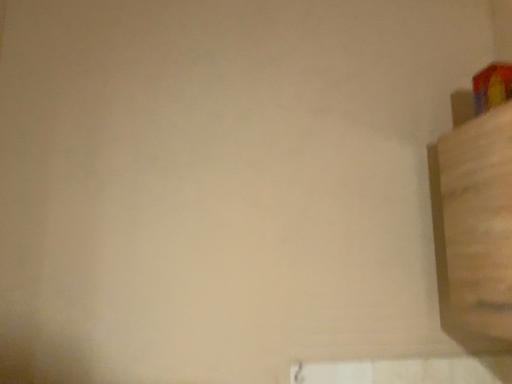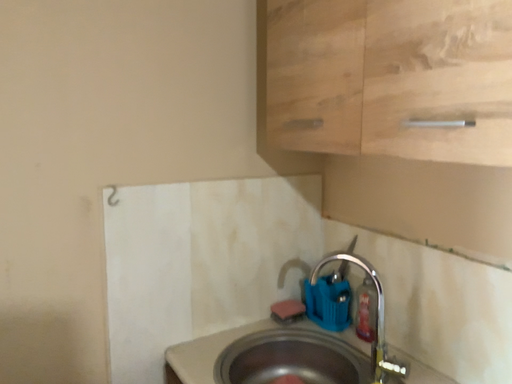
Question: Which way did the camera rotate in the video?

Choices:
 (A) rotated right
 (B) rotated left

Answer: (A)